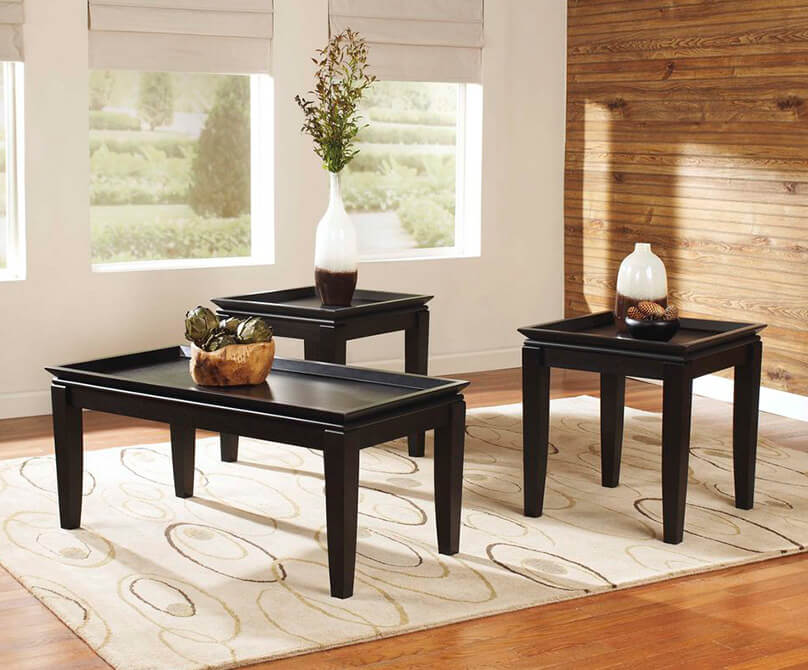
What are the coordinates of `rug` in the screenshot? It's located at (506, 571).